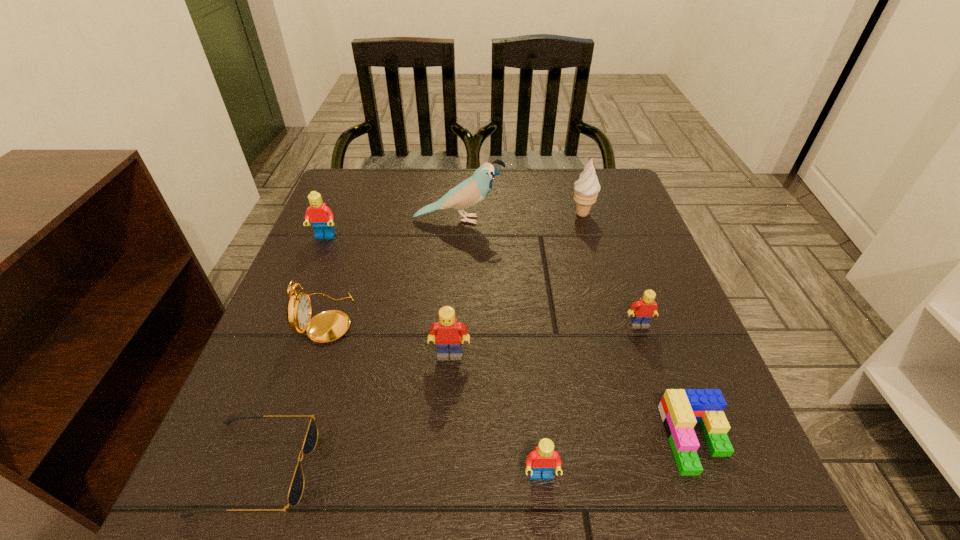
Locate an element on the screen. This screenshot has height=540, width=960. vacant space located 0.400m on the front-facing side of the sunglasses is located at coordinates 584,468.

You are a GUI agent. You are given a task and a screenshot of the screen. Output one action in this format:
    pyautogui.click(x=<x>, y=<y>)
    Task: Click on the bird at the far edge
    Image resolution: width=960 pixels, height=540 pixels.
    Given the screenshot: What is the action you would take?
    pyautogui.click(x=471, y=191)

At what (x,y) coordinates should I click in order to perform the action: click on icecream present at the far edge. Please return your answer as a coordinate pair (x, y). Looking at the image, I should click on (587, 188).

This screenshot has height=540, width=960. In order to click on sunglasses situated at the near edge in this screenshot , I will do `click(296, 489)`.

This screenshot has width=960, height=540. I want to click on Lego positioned at the left edge, so click(321, 217).

Find the location of `pocket watch present at the left edge`. pocket watch present at the left edge is located at coordinates (327, 326).

Identify the location of sunglasses that is at the left edge. The height and width of the screenshot is (540, 960). (296, 489).

Where is `icecream that is at the right edge`? The image size is (960, 540). icecream that is at the right edge is located at coordinates (587, 188).

This screenshot has height=540, width=960. I want to click on object located in the near left corner section of the desktop, so click(x=296, y=489).

Where is `object situated at the far right corner`? object situated at the far right corner is located at coordinates (587, 188).